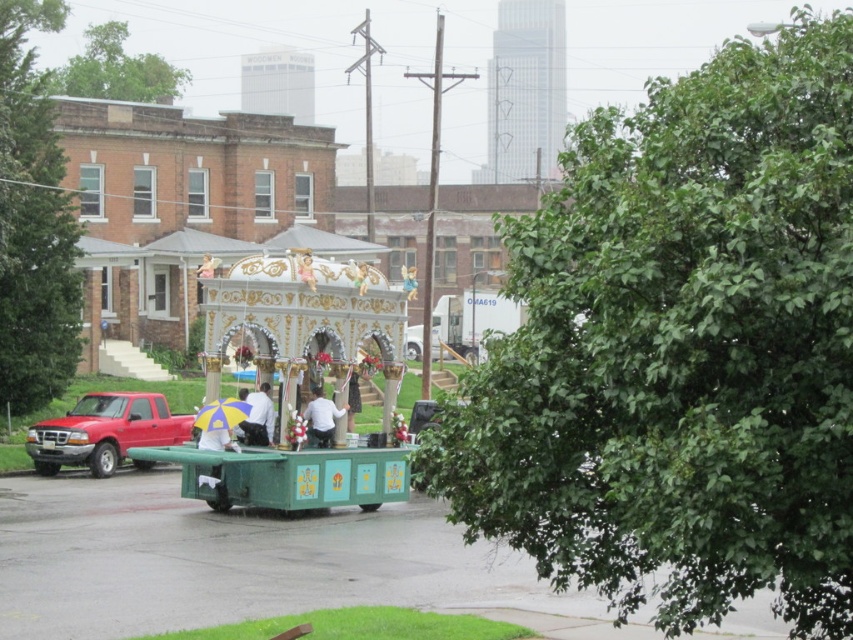
You are a photographer trying to capture the entire scene of the parade float and the people in front of it. However, you notice two objects on the left side of the image that might obstruct your shot. Which of the two objects, the green leafy tree at left or the matte red truck at left, is larger and would require more careful framing to avoid blocking the main subjects?

The green leafy tree at left is bigger than the matte red truck at left, so it would require more careful framing to avoid blocking the main subjects.

You are a photographer trying to capture a photo of both the green painted wood cart at center and the gold metallic statue at center in the same frame. Based on their heights, which object should you position closer to the camera to ensure both are fully visible?

The green painted wood cart at center is taller than the gold metallic statue at center. To ensure both are fully visible in the frame, position the gold metallic statue at center closer to the camera so its height matches the green painted wood cart at center in the photo.